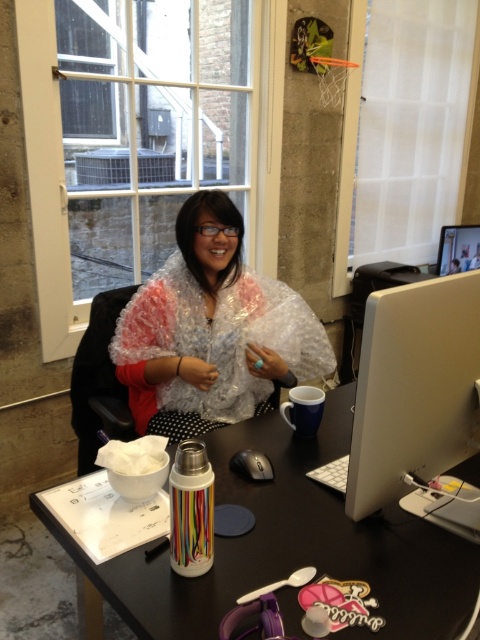
You are standing in front of the desk in the office scene. There is a point marked at coordinates (x=204, y=358). If you want to place a small object exactly at this point without moving any existing items on the desk, is the space there clear enough to do so?

The point at coordinates (x=204, y=358) is 1.70 meters away from the viewer, so yes, the space there is clear enough to place a small object without moving existing items.

Consider the image. You are an office worker who needs to place a new 10cm tall document holder on your desk. You have two options to place it either next to the sleek silver monitor at upper right or next to the blue ceramic mug at right. Which location would allow the document holder to fit vertically without blocking the monitor or the mug?

The document holder should be placed next to the sleek silver monitor at upper right because it is taller than the blue ceramic mug at right, providing more vertical space for the document holder without blocking either object.

You are a delivery person who just arrived at the office. You need to place a fragile package on the desk. The package must be placed on top of the clear plastic bubble wrap at center to protect it. However, you also need to ensure that the package does not block the blue ceramic mug at right. Is this possible given their positions?

The clear plastic bubble wrap at center is further to the viewer than the blue ceramic mug at right, so placing the package on the bubble wrap would position it closer to you. Since the mug is behind the bubble wrap, the package placed on the bubble wrap won not block the mug, so it is possible.